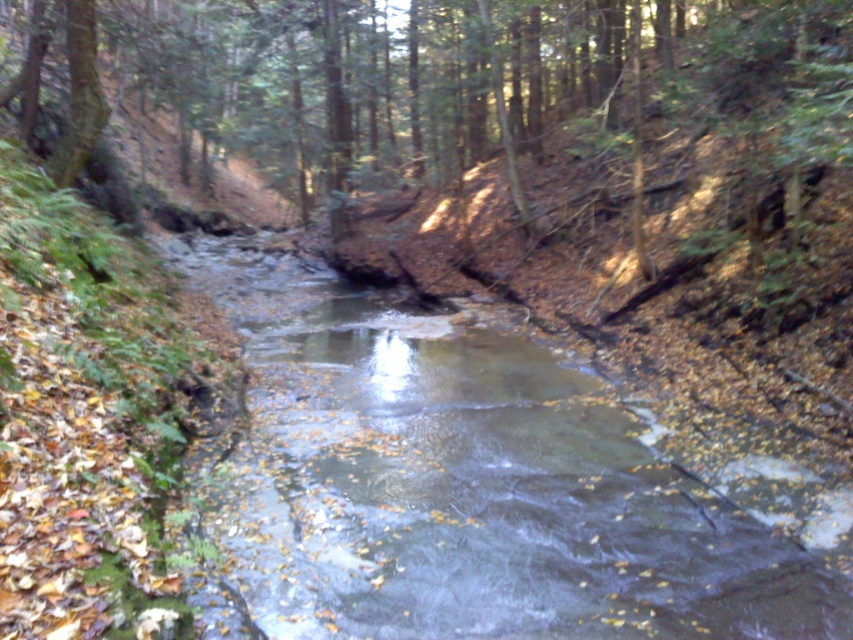
Question: Is clear water at center below brown wood tree at center?

Choices:
 (A) no
 (B) yes

Answer: (B)

Question: Which point is closer to the camera?

Choices:
 (A) (306, 289)
 (B) (48, 38)

Answer: (B)

Question: Can you confirm if clear water at center is positioned to the left of brown wood tree at center?

Choices:
 (A) no
 (B) yes

Answer: (A)

Question: Does clear water at center have a larger size compared to brown wood tree at center?

Choices:
 (A) no
 (B) yes

Answer: (A)